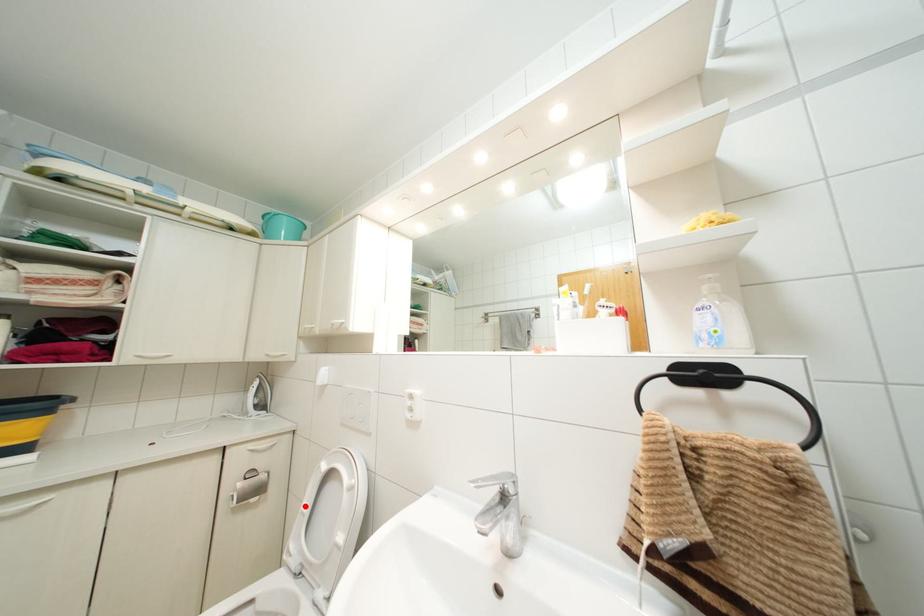
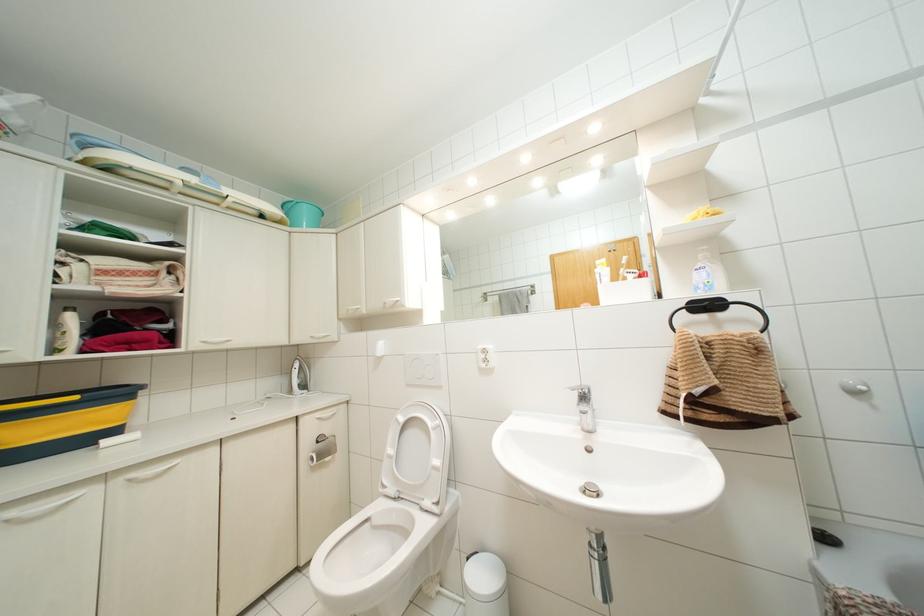
In the second image, find the point that corresponds to the highlighted location in the first image.

(390, 450)